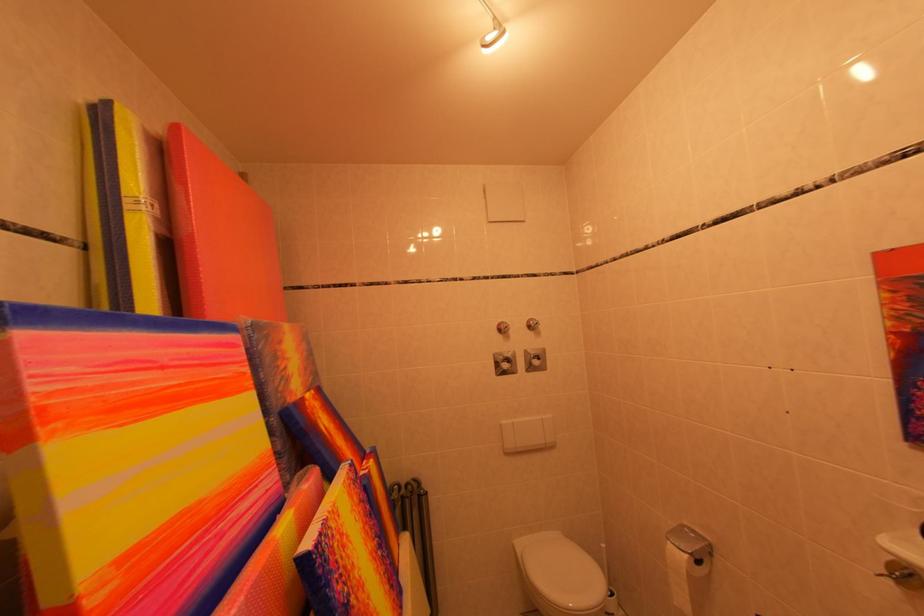
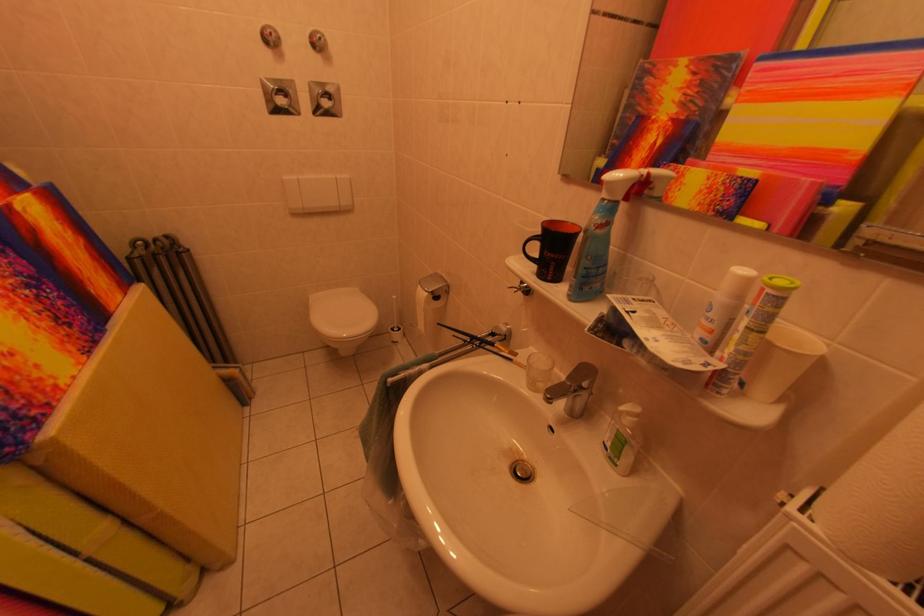
Locate, in the second image, the point that corresponds to (516,331) in the first image.

(278, 39)